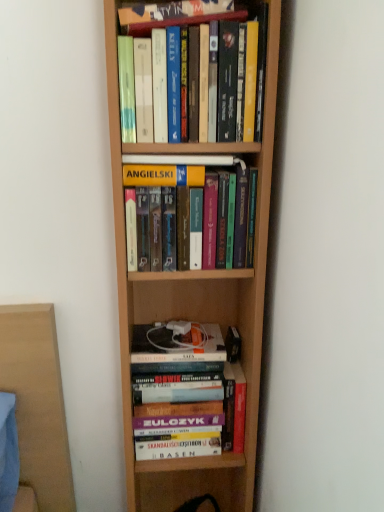
Locate an element on the screen. vacant area on top of hardcover books at center, the 1th book when ordered from bottom to top (from a real-world perspective) is located at coordinates (180, 339).